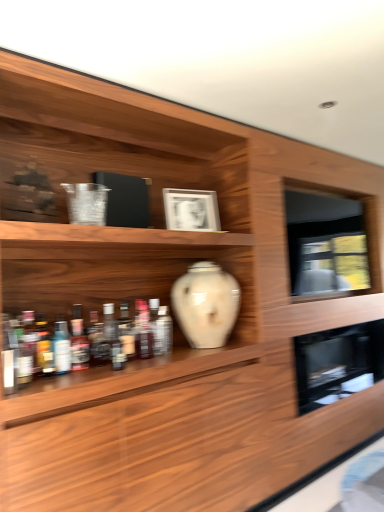
Question: Considering the relative sizes of translucent glass bottle at left, which is counted as the 7th bottle, starting from the front, and white matte picture frame at upper center in the image provided, is translucent glass bottle at left, which is counted as the 7th bottle, starting from the front, bigger than white matte picture frame at upper center?

Choices:
 (A) no
 (B) yes

Answer: (A)

Question: Is translucent glass bottle at left, which appears as the fifth bottle when viewed from the back, not inside white matte picture frame at upper center?

Choices:
 (A) yes
 (B) no

Answer: (A)

Question: From a real-world perspective, is translucent glass bottle at left, which is counted as the 7th bottle, starting from the front, physically above white matte picture frame at upper center?

Choices:
 (A) yes
 (B) no

Answer: (B)

Question: Considering the relative sizes of translucent glass bottle at left, which appears as the fifth bottle when viewed from the back, and white matte picture frame at upper center in the image provided, is translucent glass bottle at left, which appears as the fifth bottle when viewed from the back, smaller than white matte picture frame at upper center?

Choices:
 (A) no
 (B) yes

Answer: (B)

Question: Can you confirm if translucent glass bottle at left, which appears as the fifth bottle when viewed from the back, is shorter than white matte picture frame at upper center?

Choices:
 (A) yes
 (B) no

Answer: (A)

Question: From a real-world perspective, is translucent glass bottles at shelf center, the fourth bottle from the back, positioned above or below translucent glass bottle at center, which is counted as the 11th bottle, starting from the front?

Choices:
 (A) above
 (B) below

Answer: (B)

Question: In the image, is translucent glass bottles at shelf center, which is the eighth bottle from front to back, on the left side or the right side of translucent glass bottle at center, which appears as the 1th bottle when viewed from the back?

Choices:
 (A) right
 (B) left

Answer: (B)

Question: Is translucent glass bottles at shelf center, which is the eighth bottle from front to back, in front of or behind translucent glass bottle at center, which is counted as the 11th bottle, starting from the front, in the image?

Choices:
 (A) behind
 (B) front

Answer: (B)

Question: In terms of width, does translucent glass bottles at shelf center, the fourth bottle from the back, look wider or thinner when compared to translucent glass bottle at center, which appears as the 1th bottle when viewed from the back?

Choices:
 (A) thin
 (B) wide

Answer: (B)

Question: From the image's perspective, is white glossy vase at center, placed as the third bottle when sorted from back to front, above or below translucent glass bottle at left, which is counted as the 7th bottle, starting from the front?

Choices:
 (A) below
 (B) above

Answer: (A)

Question: Is point (162, 322) closer or farther from the camera than point (72, 323)?

Choices:
 (A) closer
 (B) farther

Answer: (B)

Question: Is white glossy vase at center, placed as the third bottle when sorted from back to front, situated inside translucent glass bottle at left, which is counted as the 7th bottle, starting from the front, or outside?

Choices:
 (A) inside
 (B) outside

Answer: (B)

Question: In terms of height, does white glossy vase at center, placed as the third bottle when sorted from back to front, look taller or shorter compared to translucent glass bottle at left, which is counted as the 7th bottle, starting from the front?

Choices:
 (A) tall
 (B) short

Answer: (B)

Question: From a real-world perspective, relative to translucent glass bottle at lower left, the eighth bottle when ordered from back to front, is translucent glass bottle at center, which is the sixth bottle from front to back, vertically above or below?

Choices:
 (A) above
 (B) below

Answer: (B)

Question: Is translucent glass bottle at center, which is the sixth bottle from front to back, bigger or smaller than translucent glass bottle at lower left, which is the 4th bottle from front to back?

Choices:
 (A) big
 (B) small

Answer: (A)